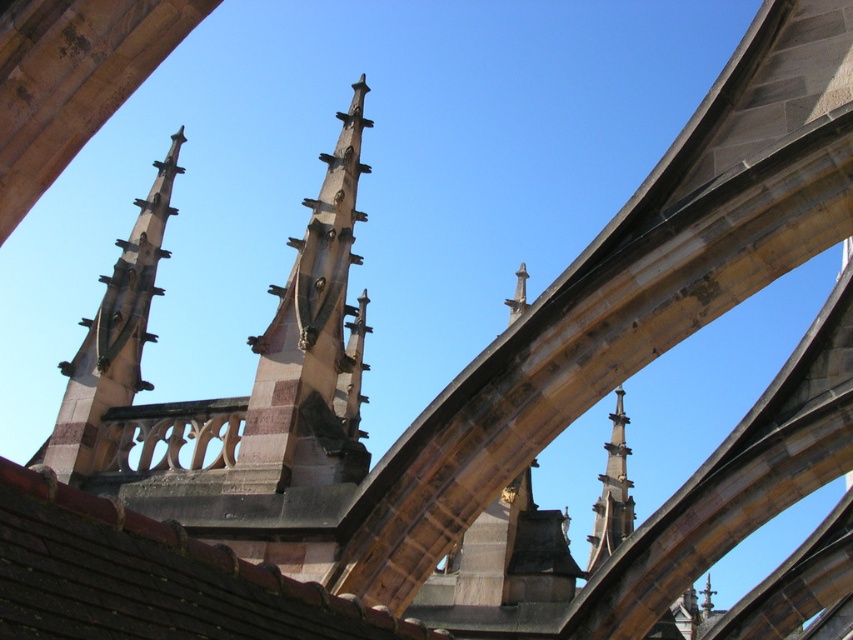
Is brown stone spire at center further to the viewer compared to smooth stone spire at center?

No, it is not.

Between brown stone spire at center and smooth stone spire at center, which one appears on the left side from the viewer's perspective?

brown stone spire at center is more to the left.

Between point (309, 456) and point (606, 552), which one is positioned behind?

The point (606, 552) is more distant.

Identify the location of brown stone spire at center. (312, 342).